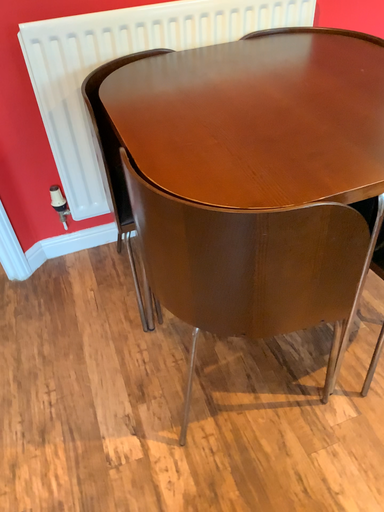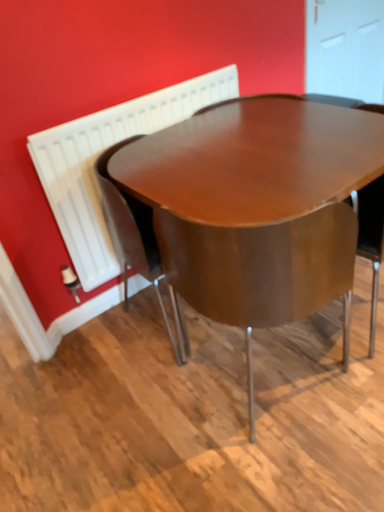
Question: Which way did the camera rotate in the video?

Choices:
 (A) rotated downward
 (B) rotated upward

Answer: (B)